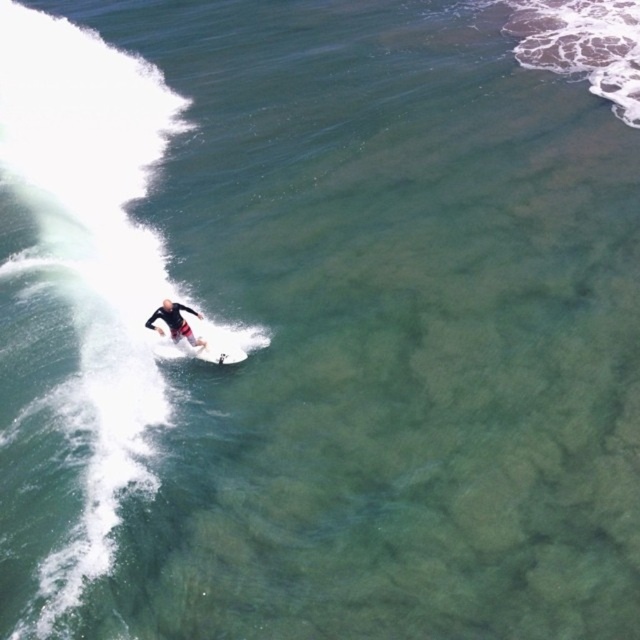
Question: Does white foam surfboard at center appear under black wetsuit surfer at center?

Choices:
 (A) yes
 (B) no

Answer: (A)

Question: Which point is closer to the camera taking this photo?

Choices:
 (A) (163, 339)
 (B) (156, 316)

Answer: (B)

Question: Is white foam surfboard at center to the right of black wetsuit surfer at center from the viewer's perspective?

Choices:
 (A) yes
 (B) no

Answer: (A)

Question: Does white foam surfboard at center appear under black wetsuit surfer at center?

Choices:
 (A) no
 (B) yes

Answer: (B)